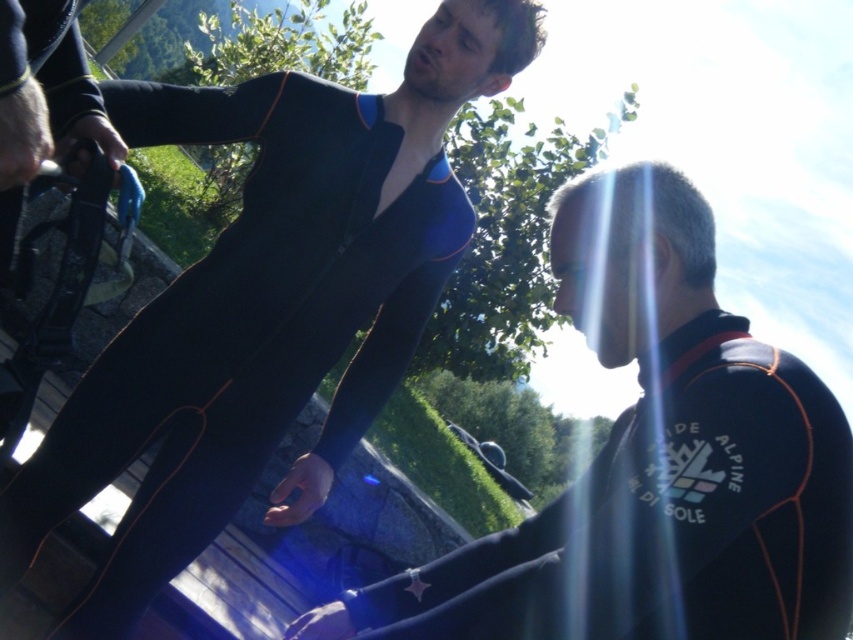
Question: Does black neoprene wetsuit at center have a smaller size compared to black neoprene wetsuit at right?

Choices:
 (A) no
 (B) yes

Answer: (A)

Question: Among these objects, which one is farthest from the camera?

Choices:
 (A) black neoprene wetsuit at right
 (B) black neoprene wetsuit at center

Answer: (B)

Question: Observing the image, what is the correct spatial positioning of black neoprene wetsuit at center in reference to black neoprene wetsuit at right?

Choices:
 (A) below
 (B) above

Answer: (B)

Question: Where is black neoprene wetsuit at center located in relation to black neoprene wetsuit at right in the image?

Choices:
 (A) right
 (B) left

Answer: (B)